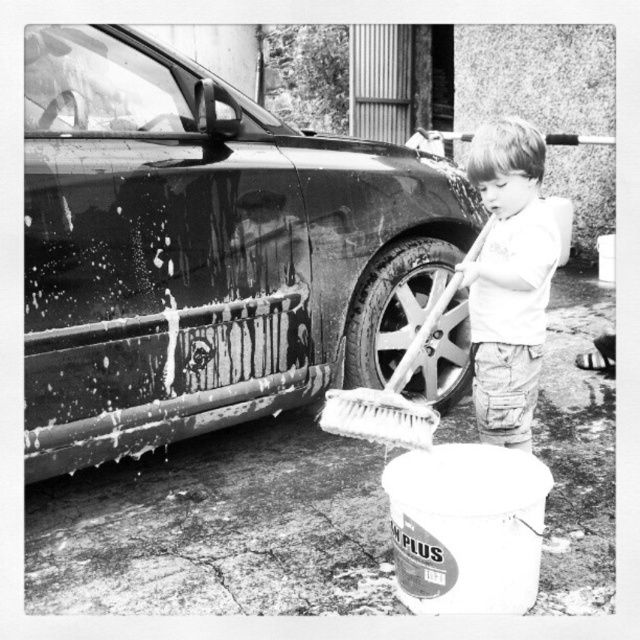
You are standing in front of the car washing scene. There are two points marked in the image. Which point, point (81, 259) or point (435, 294), is closer to you?

Point (81, 259) is closer to the viewer than point (435, 294).

You have a toy car that is 10 centimeters long. You want to place it on the shiny black car at left or the metallic silver wheel at lower center. Which object can it fit on without hanging over the edge?

The shiny black car at left is wider than the metallic silver wheel at lower center, so the toy car can fit on the shiny black car at left without hanging over the edge.

You are a photographer analyzing the composition of this image. You need to decide whether to zoom in on the metallic silver wheel at lower center or the white bristle brush at lower center to capture more details. Based on their sizes, which object should you choose?

The metallic silver wheel at lower center is larger in size than the white bristle brush at lower center, so you should zoom in on the metallic silver wheel at lower center to capture more details.